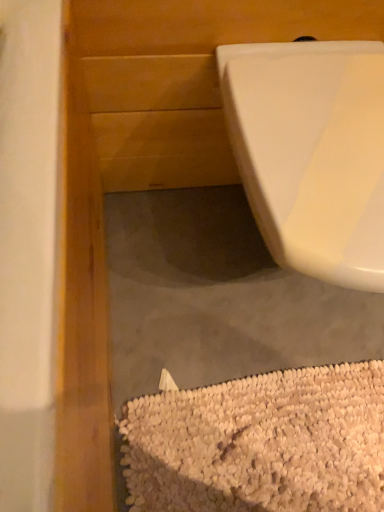
Question: In terms of height, does white glossy toilet at upper right look taller or shorter compared to white textured rug at lower right?

Choices:
 (A) tall
 (B) short

Answer: (A)

Question: In the image, is white glossy toilet at upper right positioned in front of or behind white textured rug at lower right?

Choices:
 (A) behind
 (B) front

Answer: (B)

Question: Based on their positions, is white glossy toilet at upper right located to the left or right of white textured rug at lower right?

Choices:
 (A) left
 (B) right

Answer: (B)

Question: In the image, is white textured rug at lower right positioned in front of or behind white glossy toilet at upper right?

Choices:
 (A) front
 (B) behind

Answer: (B)

Question: Is point click(137, 448) closer or farther from the camera than point click(354, 172)?

Choices:
 (A) farther
 (B) closer

Answer: (A)

Question: From a real-world perspective, is white textured rug at lower right positioned above or below white glossy toilet at upper right?

Choices:
 (A) below
 (B) above

Answer: (A)

Question: Is white textured rug at lower right taller or shorter than white glossy toilet at upper right?

Choices:
 (A) short
 (B) tall

Answer: (A)